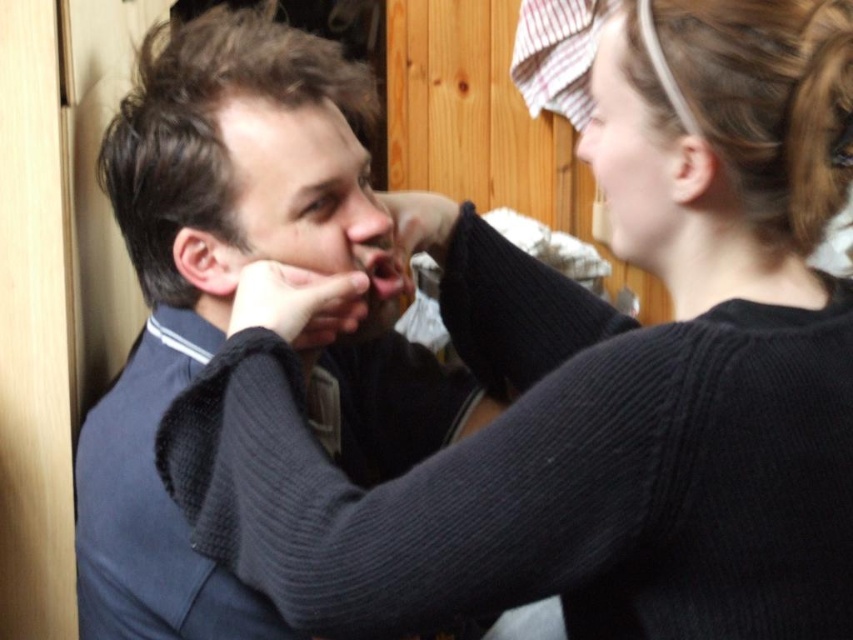
Between point (627, 54) and point (292, 308), which one is positioned in front?

Point (627, 54) is more forward.

Which of these two, matte black hair at upper right or black knitted hand at center, stands shorter?

With less height is black knitted hand at center.

Does point (683, 125) come closer to viewer compared to point (250, 282)?

Yes, point (683, 125) is closer to viewer.

Where is `matte black hair at upper right`? The image size is (853, 640). matte black hair at upper right is located at coordinates (637, 148).

Which of these two, smooth skin face at center or matte skin nose at upper center, stands shorter?

Standing shorter between the two is matte skin nose at upper center.

In the scene shown: Does smooth skin face at center come behind matte skin nose at upper center?

No, smooth skin face at center is closer to the viewer.

At what (x,y) coordinates should I click in order to perform the action: click on smooth skin face at center. Please return your answer as a coordinate pair (x, y). Image resolution: width=853 pixels, height=640 pixels. Looking at the image, I should click on (306, 205).

Can you confirm if black knitted hand at center is positioned below smooth skin nose at center?

Correct, black knitted hand at center is located below smooth skin nose at center.

Is black knitted hand at center positioned at the back of smooth skin nose at center?

No, black knitted hand at center is closer to the viewer.

The height and width of the screenshot is (640, 853). Describe the element at coordinates (289, 298) in the screenshot. I see `black knitted hand at center` at that location.

Find the location of `black knitted hand at center`. black knitted hand at center is located at coordinates (289, 298).